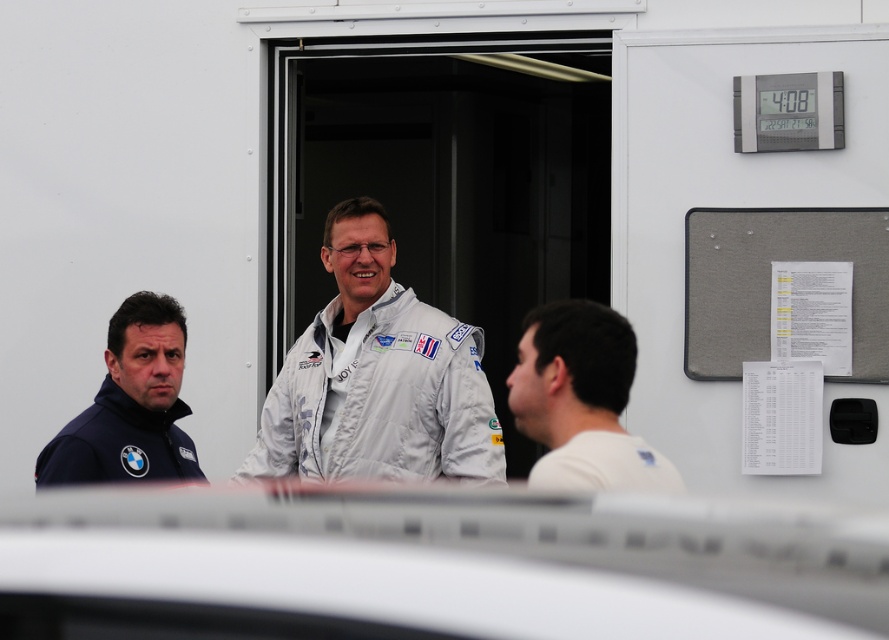
In the scene shown: Who is taller, white fabric jacket at center or dark blue fabric jacket at left?

white fabric jacket at center is taller.

Does white fabric jacket at center have a smaller size compared to dark blue fabric jacket at left?

No.

Is point (383, 436) behind point (111, 449)?

Yes.

I want to click on white fabric jacket at center, so click(377, 376).

Who is positioned more to the right, white fabric jacket at center or white matte shirt at center?

white matte shirt at center is more to the right.

Between white fabric jacket at center and white matte shirt at center, which one is positioned higher?

white fabric jacket at center

Find the location of a particular element. white fabric jacket at center is located at coordinates (377, 376).

Is white matte shirt at center further to camera compared to dark blue fabric jacket at left?

No, it is not.

Between point (551, 467) and point (157, 428), which one is positioned in front?

Positioned in front is point (551, 467).

Find the location of a particular element. Image resolution: width=889 pixels, height=640 pixels. white matte shirt at center is located at coordinates (581, 401).